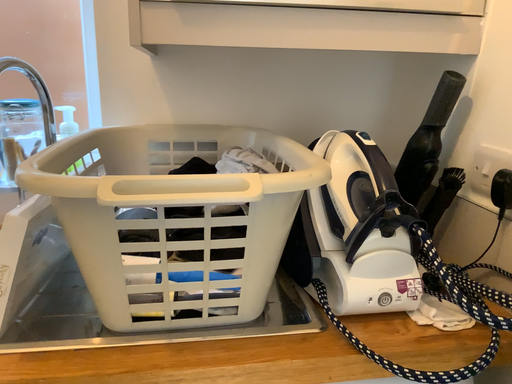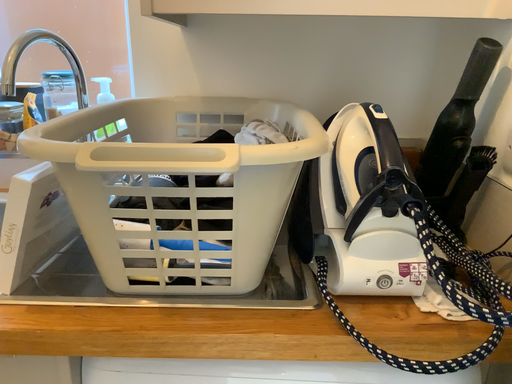
Question: Which way did the camera rotate in the video?

Choices:
 (A) rotated right
 (B) rotated left

Answer: (B)